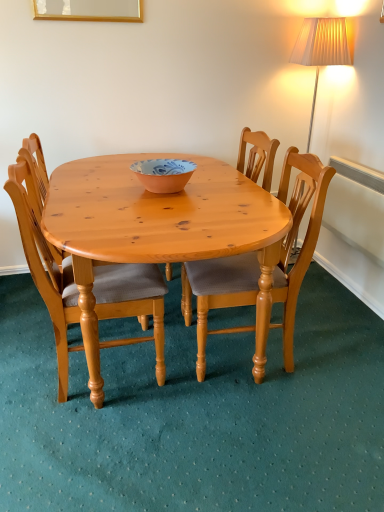
Question: Considering the relative sizes of wooden chair at center, arranged as the 2th chair when viewed from the left, and light brown wood chair at center, the 3th chair in the left-to-right sequence, in the image provided, is wooden chair at center, arranged as the 2th chair when viewed from the left, smaller than light brown wood chair at center, the 3th chair in the left-to-right sequence,?

Choices:
 (A) no
 (B) yes

Answer: (A)

Question: Is wooden chair at center, arranged as the 2th chair when viewed from the left, positioned beyond the bounds of light brown wood chair at center, the 3th chair in the left-to-right sequence?

Choices:
 (A) yes
 (B) no

Answer: (A)

Question: From a real-world perspective, is wooden chair at center, arranged as the 2th chair when viewed from the left, below light brown wood chair at center, the 3th chair in the left-to-right sequence?

Choices:
 (A) no
 (B) yes

Answer: (A)

Question: Can you confirm if wooden chair at center, positioned as the second chair in right-to-left order, is wider than light brown wood chair at center, acting as the 1th chair starting from the right?

Choices:
 (A) no
 (B) yes

Answer: (A)

Question: Is wooden chair at center, positioned as the second chair in right-to-left order, beside light brown wood chair at center, the 3th chair in the left-to-right sequence?

Choices:
 (A) yes
 (B) no

Answer: (B)

Question: From the image's perspective, does wooden chair at center, positioned as the second chair in right-to-left order, appear higher than light brown wood chair at center, the 3th chair in the left-to-right sequence?

Choices:
 (A) no
 (B) yes

Answer: (B)

Question: Does light brown wooden chair at center, the first chair when ordered from left to right, appear on the right side of blue and white ceramic bowl at center?

Choices:
 (A) yes
 (B) no

Answer: (B)

Question: Is light brown wooden chair at center, the third chair when ordered from right to left, wider than blue and white ceramic bowl at center?

Choices:
 (A) no
 (B) yes

Answer: (B)

Question: Is light brown wooden chair at center, the third chair when ordered from right to left, positioned behind blue and white ceramic bowl at center?

Choices:
 (A) yes
 (B) no

Answer: (B)

Question: From the image's perspective, is light brown wooden chair at center, the third chair when ordered from right to left, located beneath blue and white ceramic bowl at center?

Choices:
 (A) no
 (B) yes

Answer: (B)

Question: Is light brown wooden chair at center, the first chair when ordered from left to right, oriented away from blue and white ceramic bowl at center?

Choices:
 (A) no
 (B) yes

Answer: (A)

Question: Does light brown wooden chair at center, the first chair when ordered from left to right, have a smaller size compared to blue and white ceramic bowl at center?

Choices:
 (A) no
 (B) yes

Answer: (A)

Question: Can you confirm if light brown wooden chair at center, the first chair when ordered from left to right, is smaller than wooden chair at center, arranged as the 2th chair when viewed from the left?

Choices:
 (A) no
 (B) yes

Answer: (B)